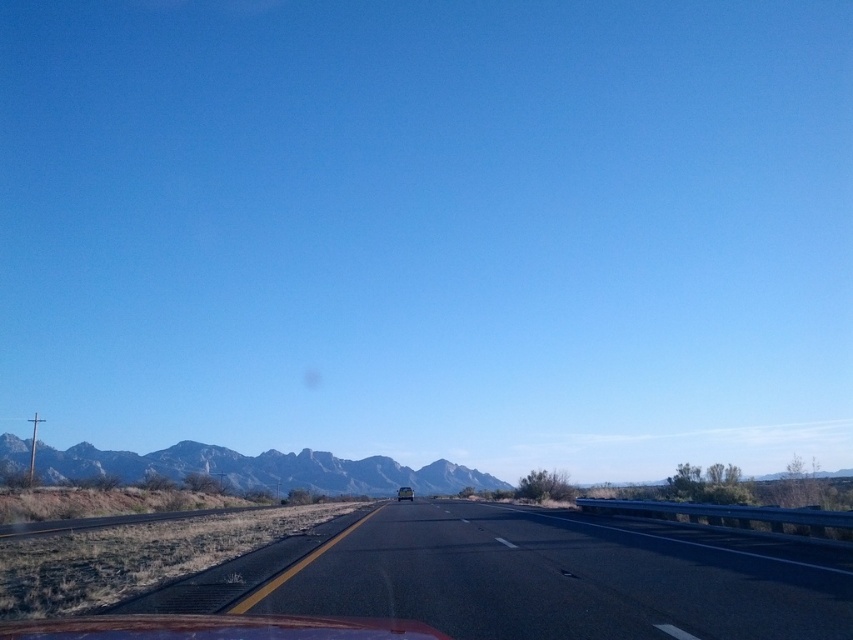
Question: Which point is closer to the camera?

Choices:
 (A) shiny silver sedan at center
 (B) rugged brown mountains at center
 (C) black asphalt highway at center

Answer: (C)

Question: Can you confirm if black asphalt highway at center is positioned to the right of rugged brown mountains at center?

Choices:
 (A) yes
 (B) no

Answer: (A)

Question: Does rugged brown mountains at center have a smaller size compared to shiny silver sedan at center?

Choices:
 (A) yes
 (B) no

Answer: (B)

Question: Which point appears closest to the camera in this image?

Choices:
 (A) coord(408,493)
 (B) coord(503,524)

Answer: (B)

Question: Which object is closer to the camera taking this photo?

Choices:
 (A) black asphalt highway at center
 (B) shiny silver sedan at center

Answer: (A)

Question: Is black asphalt highway at center positioned in front of rugged brown mountains at center?

Choices:
 (A) yes
 (B) no

Answer: (A)